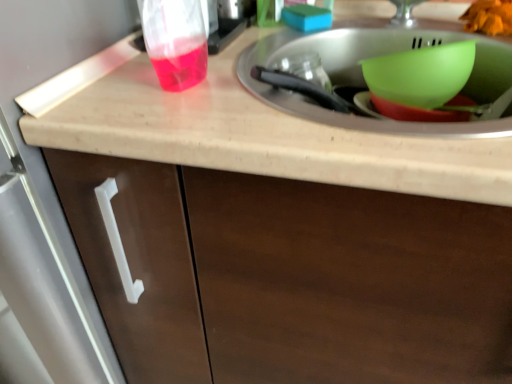
Question: Should I look upward or downward to see matte plastic sink at center?

Choices:
 (A) up
 (B) down

Answer: (A)

Question: Is beige matte countertop at upper center thinner than orange matte food at upper right?

Choices:
 (A) no
 (B) yes

Answer: (A)

Question: Does beige matte countertop at upper center have a larger size compared to orange matte food at upper right?

Choices:
 (A) yes
 (B) no

Answer: (A)

Question: Does beige matte countertop at upper center have a lesser height compared to orange matte food at upper right?

Choices:
 (A) no
 (B) yes

Answer: (A)

Question: Is beige matte countertop at upper center far away from orange matte food at upper right?

Choices:
 (A) yes
 (B) no

Answer: (B)

Question: Is beige matte countertop at upper center positioned with its back to orange matte food at upper right?

Choices:
 (A) no
 (B) yes

Answer: (A)

Question: Can you confirm if beige matte countertop at upper center is wider than orange matte food at upper right?

Choices:
 (A) no
 (B) yes

Answer: (B)

Question: Is beige matte countertop at upper center next to brown matte cabinet at center?

Choices:
 (A) no
 (B) yes

Answer: (A)

Question: Considering the relative positions of beige matte countertop at upper center and brown matte cabinet at center in the image provided, is beige matte countertop at upper center to the left of brown matte cabinet at center from the viewer's perspective?

Choices:
 (A) no
 (B) yes

Answer: (A)

Question: Considering the relative sizes of beige matte countertop at upper center and brown matte cabinet at center in the image provided, is beige matte countertop at upper center thinner than brown matte cabinet at center?

Choices:
 (A) yes
 (B) no

Answer: (A)

Question: Considering the relative positions of beige matte countertop at upper center and brown matte cabinet at center in the image provided, is beige matte countertop at upper center in front of brown matte cabinet at center?

Choices:
 (A) yes
 (B) no

Answer: (B)

Question: Is beige matte countertop at upper center at the right side of brown matte cabinet at center?

Choices:
 (A) yes
 (B) no

Answer: (A)

Question: Does beige matte countertop at upper center have a greater width compared to brown matte cabinet at center?

Choices:
 (A) no
 (B) yes

Answer: (A)

Question: Does orange matte food at upper right contain green plastic bowl at upper right?

Choices:
 (A) no
 (B) yes

Answer: (A)